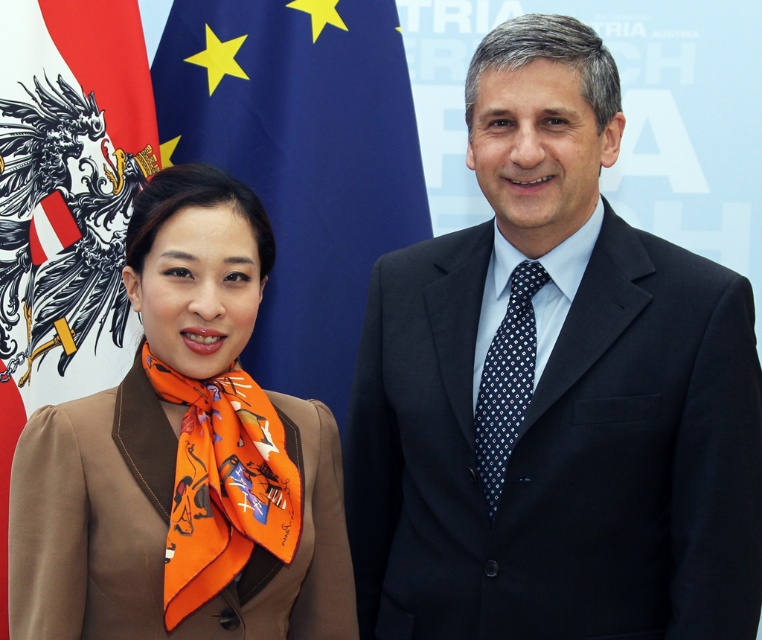
Looking at this image, you are a photographer adjusting the lighting for a portrait. You notice the dark blue suit at center and the dark blue silk tie at center in the image. Which object is closer to the camera?

The dark blue suit at center is closer to the camera because it is only 7.10 inches away from the dark blue silk tie at center, indicating proximity in the scene.

You are a photographer trying to capture a closeup of the blue fabric flag at upper center without including the brown silk scarf at left in the frame. Based on their positions, is this possible?

The brown silk scarf at left is to the left of the blue fabric flag at upper center, so by positioning the camera to the right side of the scarf and framing the shot to exclude the left area, it is possible to capture the blue fabric flag at upper center without including the brown silk scarf at left.

You are a photographer setting up for a group photo. You need to ensure that the dark blue suit at center and the brown silk scarf at left are within a 24 inch distance to fit in the frame. Based on the scene description, can both subjects be captured in the same photo without moving them?

The distance between the dark blue suit at center and the brown silk scarf at left is 20.86 inches, which is less than the 24 inch requirement. Therefore, both subjects can be captured in the same photo without moving them.